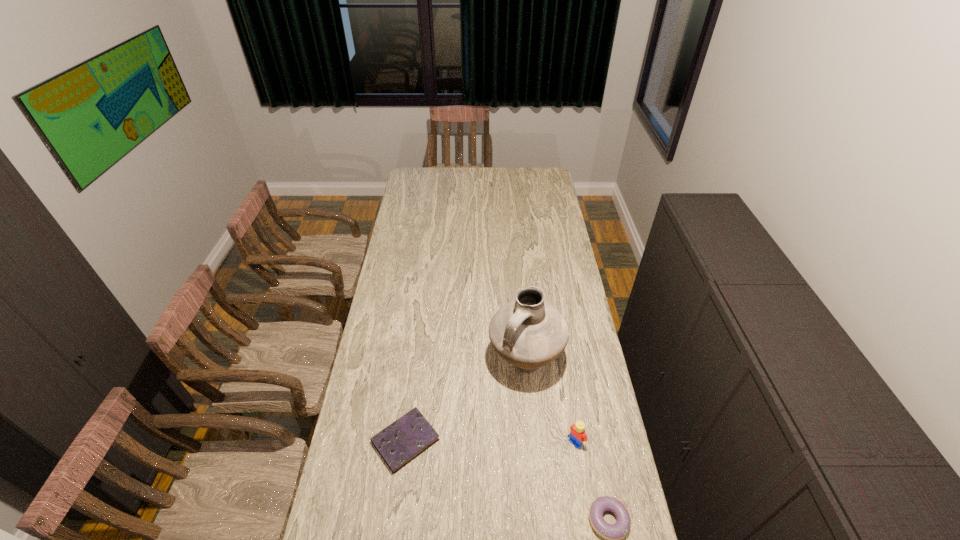
Where is `the leftmost object`? the leftmost object is located at coordinates (402, 441).

This screenshot has height=540, width=960. Find the location of `diary`. diary is located at coordinates (402, 441).

Where is `the farthest object`? This screenshot has height=540, width=960. the farthest object is located at coordinates (528, 332).

This screenshot has height=540, width=960. Find the location of `the tallest object`. the tallest object is located at coordinates (528, 332).

Find the location of a particular element. This screenshot has width=960, height=540. Lego is located at coordinates (577, 433).

Where is `vacant space located on the right of the diary`? The width and height of the screenshot is (960, 540). vacant space located on the right of the diary is located at coordinates (536, 441).

Where is `free region located 0.290m on the handle side of the tallest object`? free region located 0.290m on the handle side of the tallest object is located at coordinates (488, 465).

Locate an element on the screen. This screenshot has height=540, width=960. blank area located on the handle side of the tallest object is located at coordinates (508, 410).

This screenshot has height=540, width=960. Find the location of `blank area located on the handle side of the tallest object`. blank area located on the handle side of the tallest object is located at coordinates (477, 492).

The width and height of the screenshot is (960, 540). I want to click on blank space located 0.130m on the face of the third shortest object, so click(x=544, y=475).